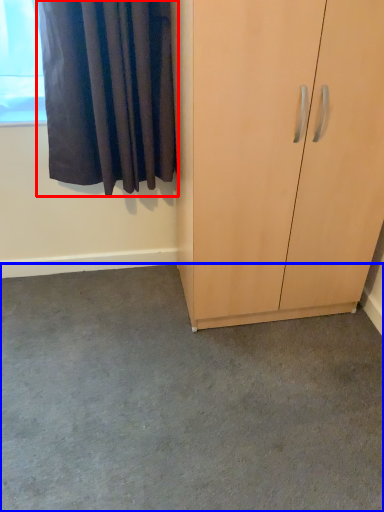
Question: Which point is closer to the camera, curtain (highlighted by a red box) or concrete (highlighted by a blue box)?

Choices:
 (A) curtain
 (B) concrete

Answer: (B)